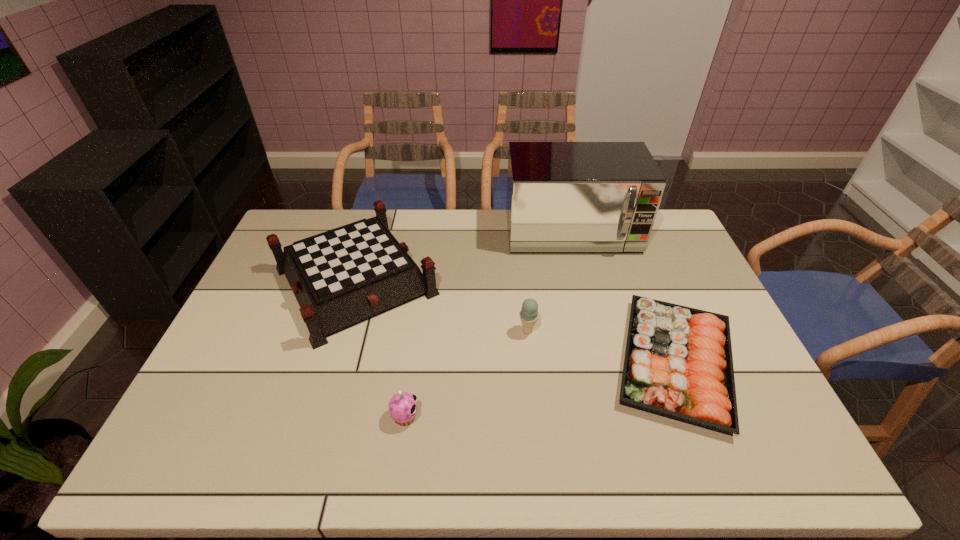
Locate an element on the screen. This screenshot has width=960, height=540. vacant space at the near edge of the desktop is located at coordinates (287, 461).

I want to click on free spot at the left edge of the desktop, so click(265, 298).

The width and height of the screenshot is (960, 540). Find the location of `vacant area at the right edge of the desktop`. vacant area at the right edge of the desktop is located at coordinates (703, 298).

At what (x,y) coordinates should I click in order to perform the action: click on vacant area at the far left corner. Please return your answer as a coordinate pair (x, y). The height and width of the screenshot is (540, 960). Looking at the image, I should click on (304, 229).

In the image, there is a desktop. Identify the location of vacant space at the far right corner. (656, 228).

Image resolution: width=960 pixels, height=540 pixels. I want to click on empty space that is in between the platter and the microwave oven, so click(623, 298).

Find the location of a particular element. The width and height of the screenshot is (960, 540). free spot between the cupcake and the microwave oven is located at coordinates (489, 325).

Image resolution: width=960 pixels, height=540 pixels. Find the location of `vacant point located between the platter and the ice cream`. vacant point located between the platter and the ice cream is located at coordinates (601, 347).

At what (x,y) coordinates should I click in order to perform the action: click on free spot between the tallest object and the ice cream. Please return your answer as a coordinate pair (x, y). This screenshot has height=540, width=960. Looking at the image, I should click on (549, 282).

Where is `empty location between the ice cream and the cupcake`? This screenshot has height=540, width=960. empty location between the ice cream and the cupcake is located at coordinates (467, 374).